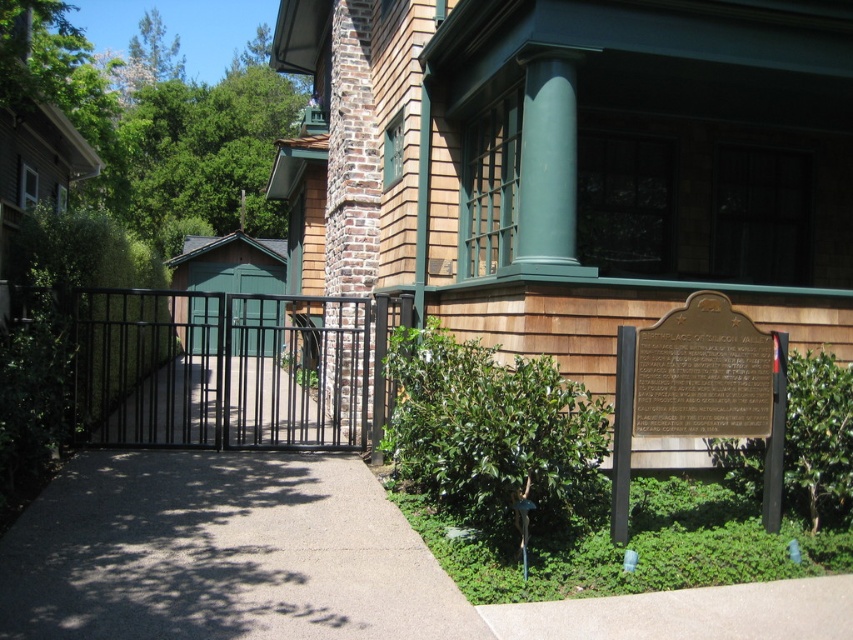
Who is more distant from viewer, [276,300] or [196,308]?

Point [196,308]

Does black metal gate at center have a lesser width compared to green wood gate at center?

In fact, black metal gate at center might be wider than green wood gate at center.

The image size is (853, 640). What do you see at coordinates (221, 365) in the screenshot?
I see `black metal gate at center` at bounding box center [221, 365].

Locate an element on the screen. The image size is (853, 640). black metal gate at center is located at coordinates (221, 365).

Does gray concrete pavement at center appear under green wood gate at center?

Correct, gray concrete pavement at center is located below green wood gate at center.

The image size is (853, 640). Identify the location of gray concrete pavement at center. (221, 554).

Who is lower down, gray concrete pavement at center or black metal gate at center?

gray concrete pavement at center is below.

Who is more distant from viewer, (379, 547) or (158, 410)?

Positioned behind is point (158, 410).

Between point (314, 605) and point (264, 374), which one is positioned behind?

Positioned behind is point (264, 374).

The height and width of the screenshot is (640, 853). In order to click on gray concrete pavement at center in this screenshot , I will do [x=221, y=554].